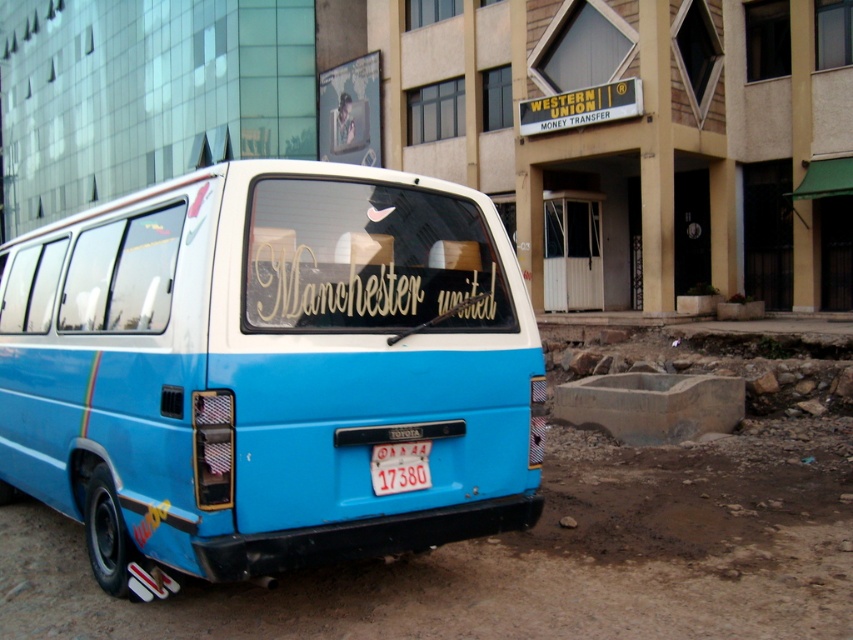
Is blue matte van at center to the right of gold metallic manchester united at center from the viewer's perspective?

No, blue matte van at center is not to the right of gold metallic manchester united at center.

Does blue matte van at center have a smaller size compared to gold metallic manchester united at center?

Yes, blue matte van at center is smaller than gold metallic manchester united at center.

Where is `blue matte van at center`? blue matte van at center is located at coordinates (270, 369).

Where is `blue matte van at center`? blue matte van at center is located at coordinates (270, 369).

Can you confirm if blue matte van at center is positioned below white plastic license plate at center?

Yes, blue matte van at center is below white plastic license plate at center.

Is blue matte van at center bigger than white plastic license plate at center?

Yes.

Does point (433, 540) come behind point (390, 474)?

Yes, it is behind point (390, 474).

What are the coordinates of `blue matte van at center` in the screenshot? It's located at (270, 369).

In the scene shown: Is gold metallic manchester united at center below white plastic license plate at center?

No, gold metallic manchester united at center is not below white plastic license plate at center.

Identify the location of gold metallic manchester united at center. This screenshot has height=640, width=853. (368, 284).